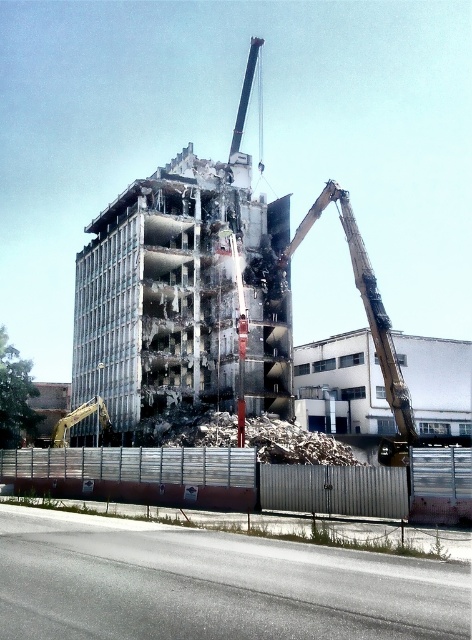
Question: Which point is farther to the camera?

Choices:
 (A) (219, 321)
 (B) (369, 301)

Answer: (A)

Question: Can you confirm if rubble concrete building at center is positioned to the left of metallic arm at upper right?

Choices:
 (A) no
 (B) yes

Answer: (B)

Question: Can you confirm if rubble concrete building at center is positioned to the right of metallic arm at upper right?

Choices:
 (A) yes
 (B) no

Answer: (B)

Question: Which object is closer to the camera taking this photo?

Choices:
 (A) rubble concrete building at center
 (B) metallic arm at upper right

Answer: (B)

Question: From the image, what is the correct spatial relationship of rubble concrete building at center in relation to metallic arm at upper right?

Choices:
 (A) above
 (B) below

Answer: (A)